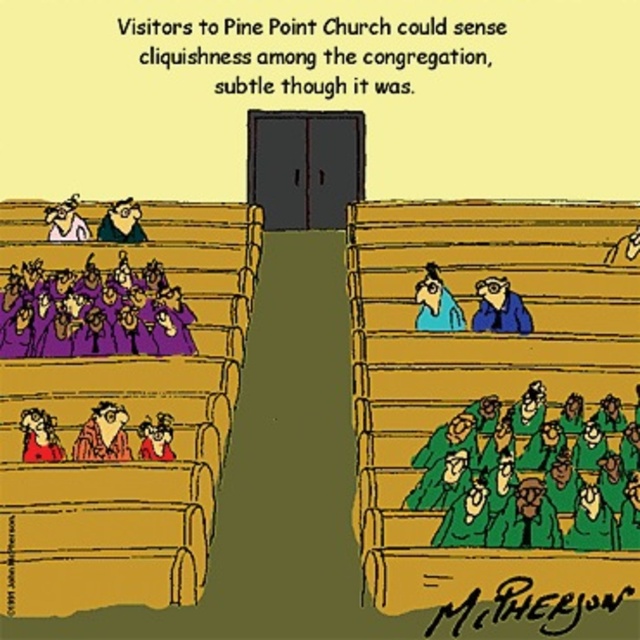
Describe the element at coordinates (499, 308) in the screenshot. The image size is (640, 640). I see `blue fabric glasses at upper right` at that location.

Between blue fabric glasses at upper right and green fabric person at lower center, which one appears on the left side from the viewer's perspective?

From the viewer's perspective, green fabric person at lower center appears more on the left side.

Identify the location of blue fabric glasses at upper right. The image size is (640, 640). (499, 308).

Is the position of wooden pews at left more distant than that of brown textured coat at lower left?

No.

Describe the element at coordinates (118, 400) in the screenshot. I see `wooden pews at left` at that location.

Image resolution: width=640 pixels, height=640 pixels. I want to click on wooden pews at left, so click(118, 400).

Is wooden pews at left positioned in front of matte black person at upper left?

Yes, it is.

Is point (122, 259) less distant than point (76, 241)?

Yes, it is in front of point (76, 241).

In order to click on wooden pews at left in this screenshot , I will do `click(118, 400)`.